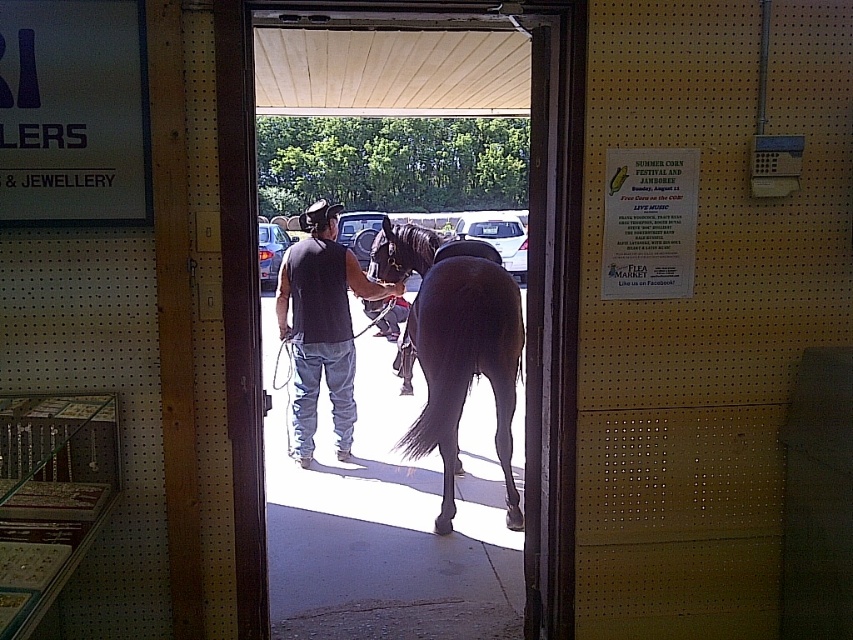
Question: Which of these objects is positioned closest to the brown glossy horse at center?

Choices:
 (A) dark gray shirt at center
 (B) wooden door at center

Answer: (A)

Question: Among these objects, which one is farthest from the camera?

Choices:
 (A) wooden door at center
 (B) dark gray shirt at center
 (C) brown glossy horse at center

Answer: (B)

Question: Does wooden door at center lie behind dark gray shirt at center?

Choices:
 (A) no
 (B) yes

Answer: (A)

Question: Is brown glossy horse at center closer to the viewer compared to dark gray shirt at center?

Choices:
 (A) yes
 (B) no

Answer: (A)

Question: Estimate the real-world distances between objects in this image. Which object is farther from the dark gray shirt at center?

Choices:
 (A) brown glossy horse at center
 (B) wooden door at center

Answer: (B)

Question: Does wooden door at center have a greater width compared to brown glossy horse at center?

Choices:
 (A) no
 (B) yes

Answer: (B)